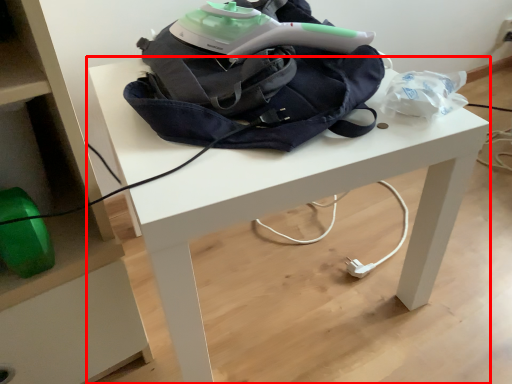
Question: Observing the image, what is the correct spatial positioning of table (annotated by the red box) in reference to bag?

Choices:
 (A) left
 (B) right

Answer: (B)